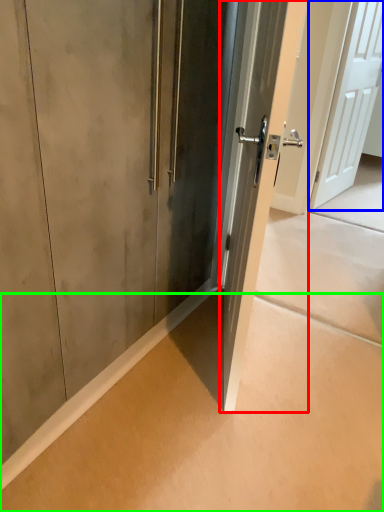
Question: Considering the real-world distances, which object is closest to door (highlighted by a red box)? door (highlighted by a blue box) or concrete (highlighted by a green box).

Choices:
 (A) door
 (B) concrete

Answer: (B)